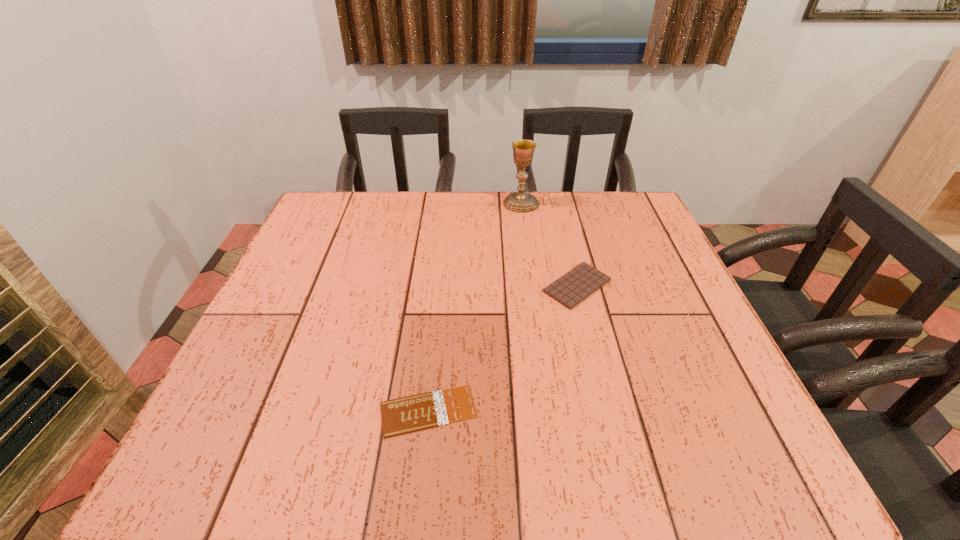
The image size is (960, 540). Identify the location of object that is at the near edge. (418, 412).

This screenshot has height=540, width=960. Find the location of `object situated at the right edge`. object situated at the right edge is located at coordinates (575, 286).

Where is `vacant space at the far edge`? Image resolution: width=960 pixels, height=540 pixels. vacant space at the far edge is located at coordinates (444, 196).

Find the location of a particular element. vacant space at the left edge of the desktop is located at coordinates click(307, 348).

You are a GUI agent. You are given a task and a screenshot of the screen. Output one action in this format:
    pyautogui.click(x=<x>, y=<y>)
    Task: Click on the vacant space at the right edge of the desktop
    
    Given the screenshot: What is the action you would take?
    pyautogui.click(x=683, y=410)

Identify the location of vacant space at the far right corner. This screenshot has width=960, height=540. (612, 195).

This screenshot has width=960, height=540. I want to click on vacant space at the near right corner of the desktop, so click(x=710, y=436).

The height and width of the screenshot is (540, 960). I want to click on unoccupied area between the leftmost object and the chalice, so click(x=474, y=307).

At what (x,y) coordinates should I click in order to perform the action: click on vacant space that's between the farther chocolate bar and the shortest object. Please return your answer as a coordinate pair (x, y). Looking at the image, I should click on (503, 348).

Locate an element on the screen. This screenshot has height=540, width=960. free space between the chalice and the shortest object is located at coordinates (474, 307).